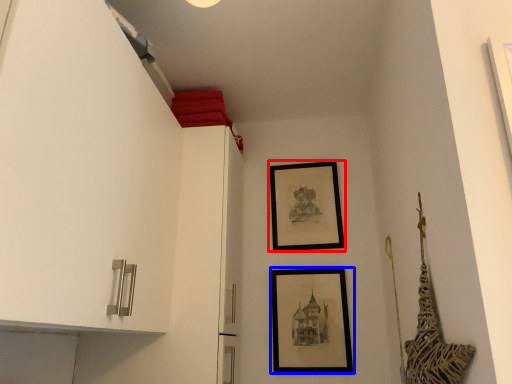
Question: Among these objects, which one is nearest to the camera, picture frame (highlighted by a red box) or picture frame (highlighted by a blue box)?

Choices:
 (A) picture frame
 (B) picture frame

Answer: (B)